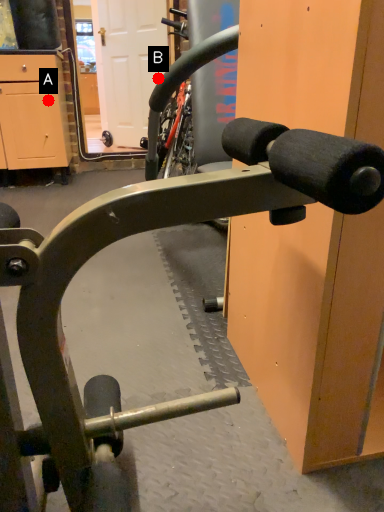
Question: Two points are circled on the image, labeled by A and B beside each circle. Which point is farther from the camera taking this photo?

Choices:
 (A) A is further
 (B) B is further

Answer: (B)